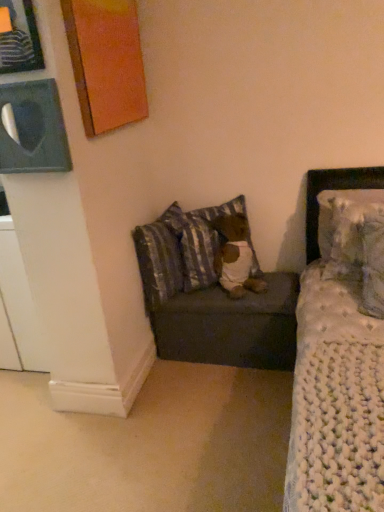
Locate an element on the screen. This screenshot has height=512, width=384. empty space that is in between brown plush bear at center and striped fabric pillow at lower center, which ranks as the third pillow in right-to-left order is located at coordinates (206, 296).